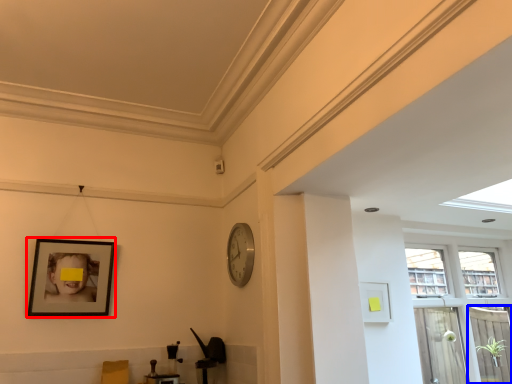
Question: Which object appears closest to the camera in this image, picture frame (highlighted by a red box) or screen door (highlighted by a blue box)?

Choices:
 (A) picture frame
 (B) screen door

Answer: (A)